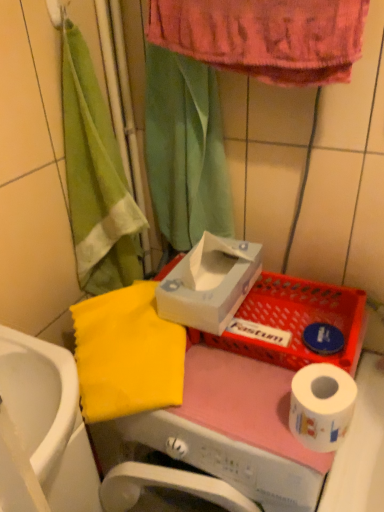
Question: Do you think white cardboard tissue box at center is within green fabric shower curtain at upper center, or outside of it?

Choices:
 (A) inside
 (B) outside

Answer: (B)

Question: Considering the positions of point (228, 262) and point (147, 77), is point (228, 262) closer or farther from the camera than point (147, 77)?

Choices:
 (A) farther
 (B) closer

Answer: (A)

Question: Which object is the closest to the white paper at lower right?

Choices:
 (A) white cardboard tissue box at center
 (B) green fabric shower curtain at upper center
 (C) white glossy sink at lower left
 (D) yellow fabric at left

Answer: (A)

Question: Which object is positioned farthest from the white glossy sink at lower left?

Choices:
 (A) white cardboard tissue box at center
 (B) green fabric shower curtain at upper center
 (C) white paper at lower right
 (D) yellow fabric at left

Answer: (B)